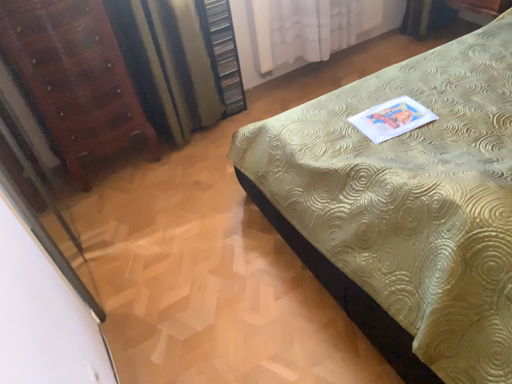
What do you see at coordinates (304, 29) in the screenshot?
I see `white sheer curtain at upper center, arranged as the second curtain when viewed from the left` at bounding box center [304, 29].

Locate an element on the screen. This screenshot has width=512, height=384. gold textured bed at center is located at coordinates (405, 207).

Describe the element at coordinates (405, 207) in the screenshot. The width and height of the screenshot is (512, 384). I see `gold textured bed at center` at that location.

Image resolution: width=512 pixels, height=384 pixels. Describe the element at coordinates (223, 53) in the screenshot. I see `wooden dresser at upper center` at that location.

Describe the element at coordinates (42, 205) in the screenshot. The image size is (512, 384). I see `transparent glass screen door at left` at that location.

From the picture: What is the approximate width of mahogany wood dresser at left?

mahogany wood dresser at left is 13.63 inches in width.

At what (x,y) coordinates should I click in order to perform the action: click on white sheer curtain at upper center, the first curtain from the right. Please return your answer as a coordinate pair (x, y). The width and height of the screenshot is (512, 384). Looking at the image, I should click on (304, 29).

Locate an element on the screen. bed on the right of transparent glass screen door at left is located at coordinates (405, 207).

Which object is further away from the camera, transparent glass screen door at left or gold textured bed at center?

Positioned behind is transparent glass screen door at left.

Is transparent glass screen door at left turned away from gold textured bed at center?

No, gold textured bed at center is not at the back of transparent glass screen door at left.

Is transparent glass screen door at left not within gold textured bed at center?

transparent glass screen door at left is positioned outside gold textured bed at center.

Can you see wooden dresser at upper center touching mahogany wood dresser at left?

No, wooden dresser at upper center is not next to mahogany wood dresser at left.

Is mahogany wood dresser at left at the back of wooden dresser at upper center?

wooden dresser at upper center is not turned away from mahogany wood dresser at left.

Is the depth of wooden dresser at upper center less than that of mahogany wood dresser at left?

No.

From the picture: From the image's perspective, is wooden dresser at upper center beneath mahogany wood dresser at left?

No.

Considering the relative sizes of gold textured bed at center and white sheer curtain at upper center, the first curtain from the right, in the image provided, is gold textured bed at center bigger than white sheer curtain at upper center, the first curtain from the right,?

Yes, gold textured bed at center is bigger than white sheer curtain at upper center, the first curtain from the right.

Between gold textured bed at center and white sheer curtain at upper center, the first curtain from the right, which one has larger width?

gold textured bed at center.

From the image's perspective, which one is positioned lower, gold textured bed at center or white sheer curtain at upper center, the first curtain from the right?

A: gold textured bed at center, from the image's perspective.

Is white sheer curtain at upper center, the first curtain from the right, beside wooden dresser at upper center?

white sheer curtain at upper center, the first curtain from the right, and wooden dresser at upper center are not in contact.

Is point (277, 10) positioned after point (230, 75)?

No, it is not.

From a real-world perspective, is white sheer curtain at upper center, arranged as the second curtain when viewed from the left, located beneath wooden dresser at upper center?

Yes, from a real-world perspective, white sheer curtain at upper center, arranged as the second curtain when viewed from the left, is below wooden dresser at upper center.

Can you confirm if wooden dresser at upper center is shorter than transparent glass screen door at left?

Yes.

Is wooden dresser at upper center positioned before transparent glass screen door at left?

No, it is not.

Is wooden dresser at upper center facing away from transparent glass screen door at left?

wooden dresser at upper center does not have its back to transparent glass screen door at left.

From a real-world perspective, is white sheer curtain at upper center, the first curtain from the right, under gold textured bed at center?

Correct, in the physical world, white sheer curtain at upper center, the first curtain from the right, is lower than gold textured bed at center.

Would you say white sheer curtain at upper center, arranged as the second curtain when viewed from the left, is to the left or to the right of gold textured bed at center in the picture?

In the image, white sheer curtain at upper center, arranged as the second curtain when viewed from the left, appears on the left side of gold textured bed at center.

From the image's perspective, does white sheer curtain at upper center, arranged as the second curtain when viewed from the left, appear lower than gold textured bed at center?

Actually, white sheer curtain at upper center, arranged as the second curtain when viewed from the left, appears above gold textured bed at center in the image.

Is white sheer curtain at upper center, arranged as the second curtain when viewed from the left, smaller than gold textured bed at center?

Yes, white sheer curtain at upper center, arranged as the second curtain when viewed from the left, is smaller than gold textured bed at center.

In the scene shown: Considering the relative sizes of mahogany wood dresser at left and gold textured bed at center in the image provided, is mahogany wood dresser at left thinner than gold textured bed at center?

Correct, the width of mahogany wood dresser at left is less than that of gold textured bed at center.

From a real-world perspective, is mahogany wood dresser at left located higher than gold textured bed at center?

Incorrect, from a real-world perspective, mahogany wood dresser at left is lower than gold textured bed at center.

What's the angular difference between mahogany wood dresser at left and gold textured bed at center's facing directions?

91.5 degrees separate the facing orientations of mahogany wood dresser at left and gold textured bed at center.

From the image's perspective, relative to gold textured bed at center, is mahogany wood dresser at left above or below?

Based on their image positions, mahogany wood dresser at left is located above gold textured bed at center.

Where is `bed above the transparent glass screen door at left (from a real-world perspective)`? The image size is (512, 384). bed above the transparent glass screen door at left (from a real-world perspective) is located at coordinates tap(405, 207).

The height and width of the screenshot is (384, 512). I want to click on dresser on the right of the mahogany wood dresser at left, so tap(223, 53).

Considering their positions, is wooden dresser at upper center positioned closer to white sheer curtain at upper center, arranged as the second curtain when viewed from the left, than mahogany wood dresser at left?

wooden dresser at upper center is positioned closer to the anchor white sheer curtain at upper center, arranged as the second curtain when viewed from the left.

Looking at the image, which one is located closer to gold textured bed at center, mahogany wood dresser at left or white sheer curtain at upper center, the first curtain from the right?

mahogany wood dresser at left is positioned closer to the anchor gold textured bed at center.

When comparing their distances from mahogany wood dresser at left, does gold textured bed at center or wooden dresser at upper center seem further?

gold textured bed at center lies further to mahogany wood dresser at left than the other object.

Looking at the image, which one is located further to striped fabric curtain at left, positioned as the 2th curtain in right-to-left order, wooden dresser at upper center or transparent glass screen door at left?

transparent glass screen door at left is positioned further to the anchor striped fabric curtain at left, positioned as the 2th curtain in right-to-left order.

Looking at the image, which one is located closer to striped fabric curtain at left, positioned as the 2th curtain in right-to-left order, mahogany wood dresser at left or gold textured bed at center?

The object closer to striped fabric curtain at left, positioned as the 2th curtain in right-to-left order, is mahogany wood dresser at left.

Which object lies further to the anchor point mahogany wood dresser at left, gold textured bed at center or striped fabric curtain at left, positioned as the 2th curtain in right-to-left order?

Based on the image, gold textured bed at center appears to be further to mahogany wood dresser at left.

From the image, which object appears to be nearer to transparent glass screen door at left, striped fabric curtain at left, marked as the first curtain in a left-to-right arrangement, or mahogany wood dresser at left?

Among the two, mahogany wood dresser at left is located nearer to transparent glass screen door at left.

From the image, which object appears to be farther from transparent glass screen door at left, white sheer curtain at upper center, the first curtain from the right, or gold textured bed at center?

white sheer curtain at upper center, the first curtain from the right.

The width and height of the screenshot is (512, 384). Find the location of `furniture between transparent glass screen door at left and white sheer curtain at upper center, the first curtain from the right, in the horizontal direction`. furniture between transparent glass screen door at left and white sheer curtain at upper center, the first curtain from the right, in the horizontal direction is located at coordinates (74, 77).

Find the location of `dresser between transparent glass screen door at left and white sheer curtain at upper center, arranged as the second curtain when viewed from the left, from front to back`. dresser between transparent glass screen door at left and white sheer curtain at upper center, arranged as the second curtain when viewed from the left, from front to back is located at coordinates (223, 53).

Identify the location of furniture between transparent glass screen door at left and gold textured bed at center. (74, 77).

Where is `curtain between gold textured bed at center and white sheer curtain at upper center, the first curtain from the right, in the front-back direction`? Image resolution: width=512 pixels, height=384 pixels. curtain between gold textured bed at center and white sheer curtain at upper center, the first curtain from the right, in the front-back direction is located at coordinates (168, 63).